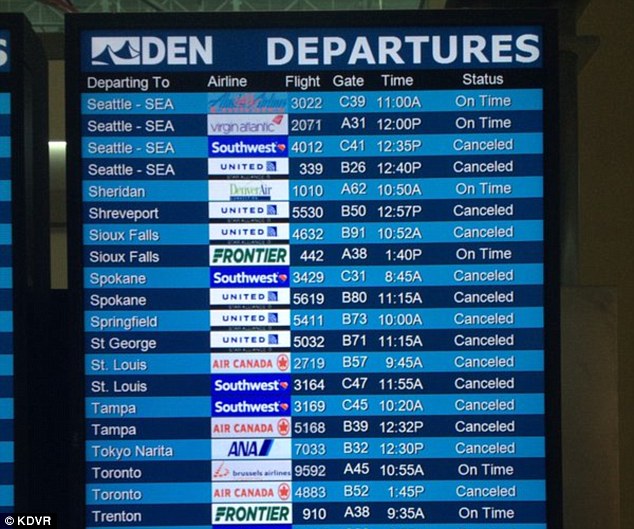
The height and width of the screenshot is (529, 634). I want to click on tv screen, so click(x=13, y=352), click(x=338, y=334).